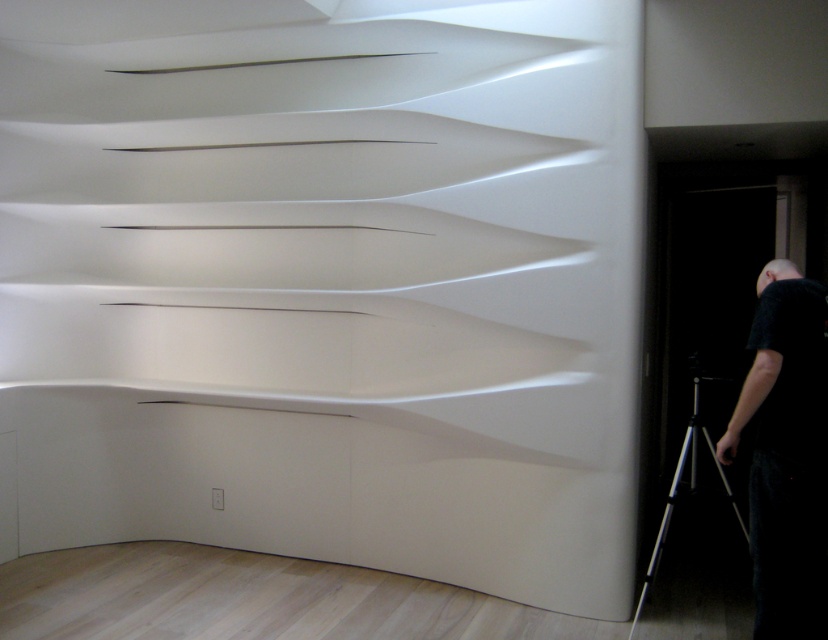
You are standing in the room and want to take a photo of the sculptural wave wall. You have a camera on the silver metallic tripod at lower right. To frame the black matte person at lower right in the foreground, should you move the tripod closer to or farther from the wall?

The black matte person at lower right is closer to the viewer than the silver metallic tripod at lower right. To include the black matte person at lower right in the foreground, you should move the tripod closer to the wall so that the camera can capture both the person and the wall in the frame.

You are standing in the room and want to take a photo of the wave wall. You have a black matte person at lower right and a silver metallic tripod at lower right. Which object can you use to stabilize your camera for the photo?

The silver metallic tripod at lower right can be used to stabilize the camera because tripods are designed for this purpose, whereas the black matte person at lower right is a person and not suitable for stabilization.

You are a photographer standing in the room and want to take a photo of the sculptural wave wall. You have a camera mounted on a silver metallic tripod at lower right. The black matte person at lower right is currently blocking your view. Can you move the tripod closer to the wall without moving the black matte person to avoid the obstruction?

The distance between the black matte person at lower right and the silver metallic tripod at lower right is 1.34 meters. Since the tripod is 1.34 meters away from the person, moving it closer to the wall would require moving it past the person, which would still block the view unless moved sideways or repositioned around the person.